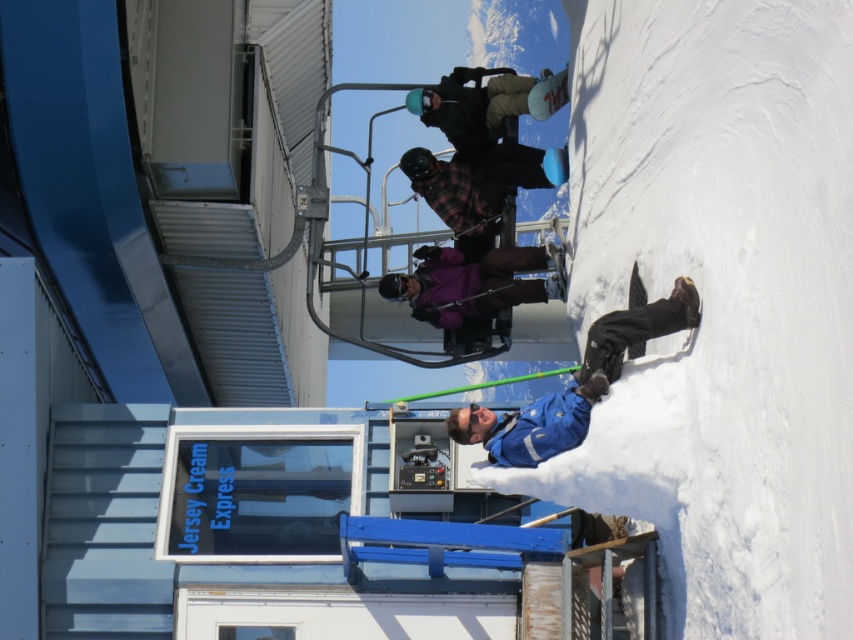
Question: Can you confirm if plaid fabric shirt at center is positioned to the left of matte black snowboard at upper center?

Choices:
 (A) yes
 (B) no

Answer: (B)

Question: Which point is farther to the camera?

Choices:
 (A) (515, 282)
 (B) (459, 176)
 (C) (519, 104)
 (D) (451, 429)

Answer: (B)

Question: Which object is closer to the camera taking this photo?

Choices:
 (A) matte black snowboard at upper center
 (B) plaid fabric shirt at center
 (C) blue fabric jacket at center

Answer: (C)

Question: Observing the image, what is the correct spatial positioning of purple matte jacket at center in reference to plaid fabric shirt at center?

Choices:
 (A) above
 (B) below

Answer: (B)

Question: Which object is positioned closest to the blue fabric jacket at center?

Choices:
 (A) purple matte jacket at center
 (B) matte black snowboard at upper center
 (C) plaid fabric shirt at center

Answer: (A)

Question: From the image, what is the correct spatial relationship of matte black snowboard at upper center in relation to blue fabric jacket at center?

Choices:
 (A) above
 (B) below

Answer: (A)